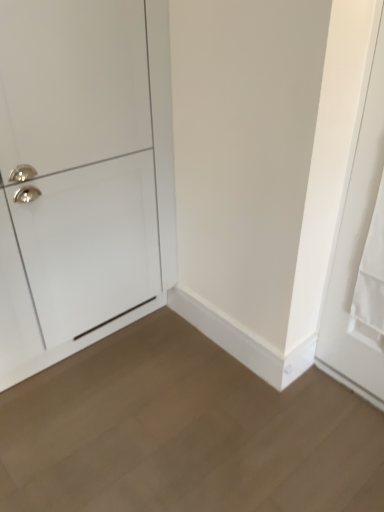
Question: Considering the positions of white matte door at right, the first door when ordered from right to left, and light brown wood floor at lower center in the image, is white matte door at right, the first door when ordered from right to left, bigger or smaller than light brown wood floor at lower center?

Choices:
 (A) small
 (B) big

Answer: (A)

Question: Considering their positions, is white matte door at right, the first door when ordered from right to left, located in front of or behind light brown wood floor at lower center?

Choices:
 (A) front
 (B) behind

Answer: (B)

Question: Considering the real-world distances, which object is closest to the white matte door at right, the second door positioned from the left?

Choices:
 (A) light brown wood floor at lower center
 (B) white glossy cabinet at left, the second door in the right-to-left sequence

Answer: (A)

Question: Estimate the real-world distances between objects in this image. Which object is closer to the white matte door at right, the first door when ordered from right to left?

Choices:
 (A) white glossy cabinet at left, the second door in the right-to-left sequence
 (B) light brown wood floor at lower center

Answer: (B)